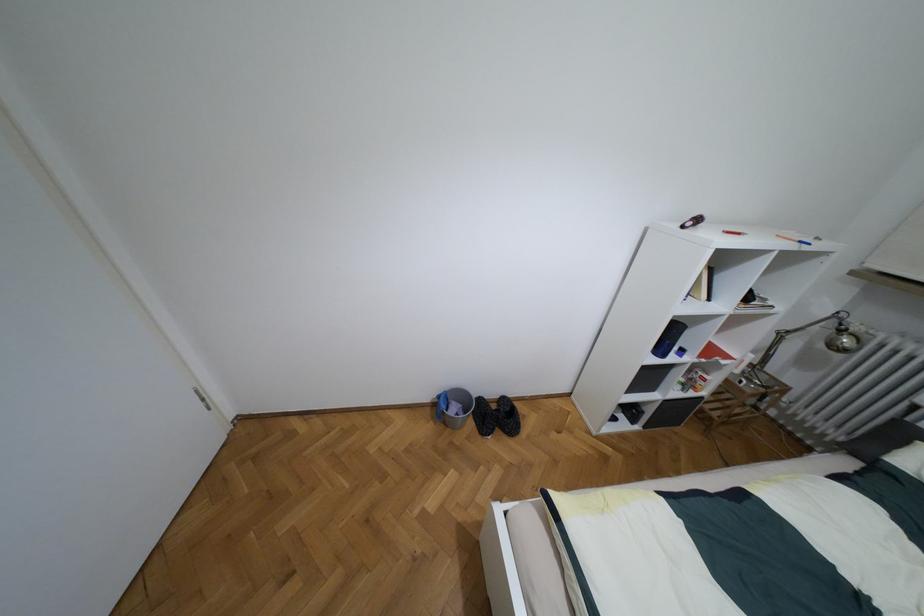
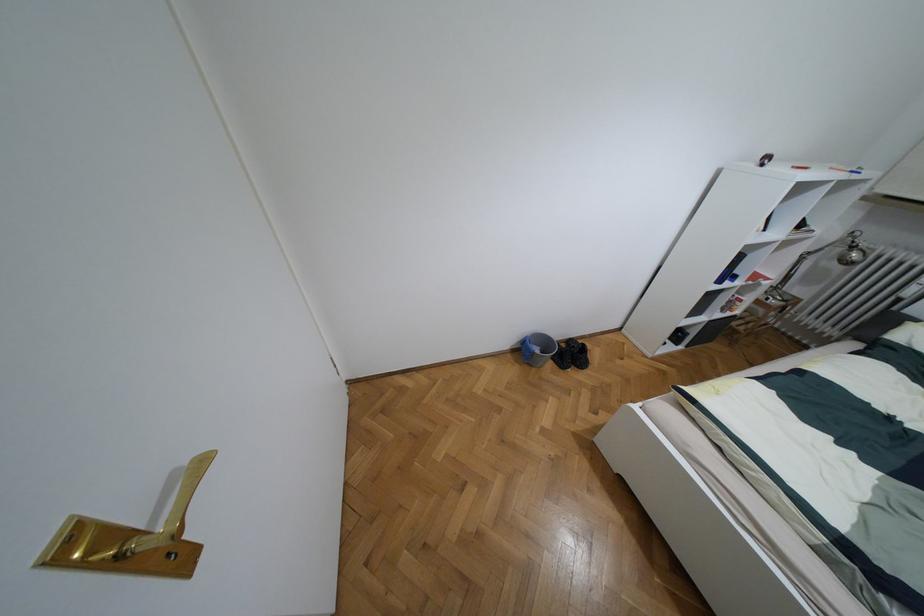
Where in the second image is the point corresponding to (453,408) from the first image?

(536, 350)